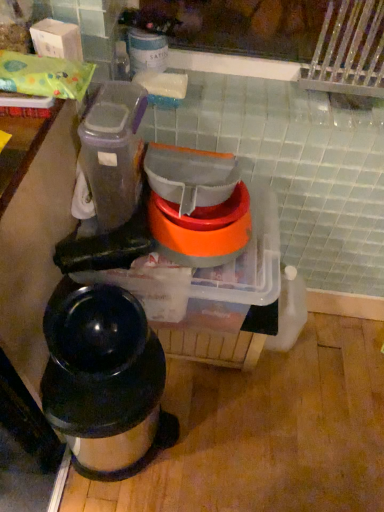
Describe the element at coordinates (191, 255) in the screenshot. Image resolution: width=384 pixels, height=512 pixels. I see `translucent plastic containers at center, the 1th appliance positioned from the bottom` at that location.

Image resolution: width=384 pixels, height=512 pixels. I want to click on translucent plastic container at upper left, acting as the 1th appliance starting from the top, so click(x=113, y=151).

This screenshot has height=512, width=384. What do you see at coordinates (201, 230) in the screenshot?
I see `orange translucent bowls at center, which is counted as the 2th appliance, starting from the top` at bounding box center [201, 230].

This screenshot has height=512, width=384. I want to click on translucent plastic containers at center, which appears as the 3th appliance when viewed from the top, so click(x=191, y=255).

Which of these two, orange translucent bowls at center, which is counted as the 2th appliance, starting from the top, or translucent plastic containers at center, which appears as the 3th appliance when viewed from the top, is wider?

translucent plastic containers at center, which appears as the 3th appliance when viewed from the top.

Considering the sizes of objects orange translucent bowls at center, which is counted as the 2th appliance, starting from the top, and translucent plastic containers at center, the 1th appliance positioned from the bottom, in the image provided, who is bigger, orange translucent bowls at center, which is counted as the 2th appliance, starting from the top, or translucent plastic containers at center, the 1th appliance positioned from the bottom,?

translucent plastic containers at center, the 1th appliance positioned from the bottom.

Considering the positions of objects translucent plastic containers at center, which appears as the 3th appliance when viewed from the top, and translucent plastic container at upper left, acting as the 1th appliance starting from the top, in the image provided, who is more to the left, translucent plastic containers at center, which appears as the 3th appliance when viewed from the top, or translucent plastic container at upper left, acting as the 1th appliance starting from the top,?

translucent plastic container at upper left, acting as the 1th appliance starting from the top, is more to the left.

Consider the image. From the image's perspective, is translucent plastic containers at center, the 1th appliance positioned from the bottom, below translucent plastic container at upper left, acting as the 1th appliance starting from the top?

Correct, translucent plastic containers at center, the 1th appliance positioned from the bottom, appears lower than translucent plastic container at upper left, acting as the 1th appliance starting from the top, in the image.

Is translucent plastic containers at center, which appears as the 3th appliance when viewed from the top, looking in the opposite direction of translucent plastic container at upper left, which is the 3th appliance in bottom-to-top order?

No, translucent plastic containers at center, which appears as the 3th appliance when viewed from the top, is not facing away from translucent plastic container at upper left, which is the 3th appliance in bottom-to-top order.

From a real-world perspective, which object stands above the other?

translucent plastic container at upper left, which is the 3th appliance in bottom-to-top order.

Between translucent plastic containers at center, which appears as the 3th appliance when viewed from the top, and orange translucent bowls at center, which appears as the 2th appliance when ordered from the bottom, which one has less height?

Standing shorter between the two is orange translucent bowls at center, which appears as the 2th appliance when ordered from the bottom.

Which object is positioned more to the left, translucent plastic containers at center, the 1th appliance positioned from the bottom, or orange translucent bowls at center, which is counted as the 2th appliance, starting from the top?

Positioned to the left is translucent plastic containers at center, the 1th appliance positioned from the bottom.

Consider the image. From a real-world perspective, is translucent plastic containers at center, the 1th appliance positioned from the bottom, physically located above or below orange translucent bowls at center, which is counted as the 2th appliance, starting from the top?

From a real-world perspective, translucent plastic containers at center, the 1th appliance positioned from the bottom, is physically below orange translucent bowls at center, which is counted as the 2th appliance, starting from the top.

From the image's perspective, is translucent plastic containers at center, which appears as the 3th appliance when viewed from the top, positioned above or below orange translucent bowls at center, which appears as the 2th appliance when ordered from the bottom?

translucent plastic containers at center, which appears as the 3th appliance when viewed from the top, is below orange translucent bowls at center, which appears as the 2th appliance when ordered from the bottom.

Would you consider translucent plastic container at upper left, which is the 3th appliance in bottom-to-top order, to be distant from translucent plastic containers at center, which appears as the 3th appliance when viewed from the top?

That's not correct — translucent plastic container at upper left, which is the 3th appliance in bottom-to-top order, is a little close to translucent plastic containers at center, which appears as the 3th appliance when viewed from the top.

Based on the photo, is translucent plastic container at upper left, which is the 3th appliance in bottom-to-top order, bigger or smaller than translucent plastic containers at center, which appears as the 3th appliance when viewed from the top?

Clearly, translucent plastic container at upper left, which is the 3th appliance in bottom-to-top order, is smaller in size than translucent plastic containers at center, which appears as the 3th appliance when viewed from the top.

Is translucent plastic container at upper left, acting as the 1th appliance starting from the top, positioned with its back to translucent plastic containers at center, which appears as the 3th appliance when viewed from the top?

That's not correct — translucent plastic container at upper left, acting as the 1th appliance starting from the top, is not looking away from translucent plastic containers at center, which appears as the 3th appliance when viewed from the top.

How different are the orientations of translucent plastic container at upper left, which is the 3th appliance in bottom-to-top order, and orange translucent bowls at center, which appears as the 2th appliance when ordered from the bottom, in degrees?

The angle between the facing direction of translucent plastic container at upper left, which is the 3th appliance in bottom-to-top order, and the facing direction of orange translucent bowls at center, which appears as the 2th appliance when ordered from the bottom, is 0.00031 degrees.

How distant is translucent plastic container at upper left, acting as the 1th appliance starting from the top, from orange translucent bowls at center, which appears as the 2th appliance when ordered from the bottom?

The distance of translucent plastic container at upper left, acting as the 1th appliance starting from the top, from orange translucent bowls at center, which appears as the 2th appliance when ordered from the bottom, is 6.36 inches.

Considering the sizes of objects translucent plastic container at upper left, acting as the 1th appliance starting from the top, and orange translucent bowls at center, which is counted as the 2th appliance, starting from the top, in the image provided, who is bigger, translucent plastic container at upper left, acting as the 1th appliance starting from the top, or orange translucent bowls at center, which is counted as the 2th appliance, starting from the top,?

Bigger between the two is translucent plastic container at upper left, acting as the 1th appliance starting from the top.

Which is more to the right, translucent plastic container at upper left, acting as the 1th appliance starting from the top, or orange translucent bowls at center, which appears as the 2th appliance when ordered from the bottom?

orange translucent bowls at center, which appears as the 2th appliance when ordered from the bottom.

Is orange translucent bowls at center, which is counted as the 2th appliance, starting from the top, bigger than translucent plastic container at upper left, acting as the 1th appliance starting from the top?

Actually, orange translucent bowls at center, which is counted as the 2th appliance, starting from the top, might be smaller than translucent plastic container at upper left, acting as the 1th appliance starting from the top.

From a real-world perspective, who is located lower, orange translucent bowls at center, which appears as the 2th appliance when ordered from the bottom, or translucent plastic container at upper left, acting as the 1th appliance starting from the top?

From a 3D spatial view, orange translucent bowls at center, which appears as the 2th appliance when ordered from the bottom, is below.

Would you consider orange translucent bowls at center, which appears as the 2th appliance when ordered from the bottom, to be distant from translucent plastic container at upper left, acting as the 1th appliance starting from the top?

They are positioned close to each other.

In the scene shown: How distant is orange translucent bowls at center, which appears as the 2th appliance when ordered from the bottom, from translucent plastic container at upper left, which is the 3th appliance in bottom-to-top order?

orange translucent bowls at center, which appears as the 2th appliance when ordered from the bottom, and translucent plastic container at upper left, which is the 3th appliance in bottom-to-top order, are 16.16 centimeters apart.

Based on the photo, which of these two, translucent plastic container at upper left, acting as the 1th appliance starting from the top, or shiny black thermos at lower left, stands taller?

shiny black thermos at lower left.

Considering the sizes of objects translucent plastic container at upper left, acting as the 1th appliance starting from the top, and shiny black thermos at lower left in the image provided, who is bigger, translucent plastic container at upper left, acting as the 1th appliance starting from the top, or shiny black thermos at lower left?

shiny black thermos at lower left.

Does translucent plastic container at upper left, which is the 3th appliance in bottom-to-top order, turn towards shiny black thermos at lower left?

No, translucent plastic container at upper left, which is the 3th appliance in bottom-to-top order, is not turned towards shiny black thermos at lower left.

You are a GUI agent. You are given a task and a screenshot of the screen. Output one action in this format:
    pyautogui.click(x=<x>, y=<y>)
    Task: Click on the waste container behind the translucent plastic container at upper left, which is the 3th appliance in bottom-to-top order
    The image size is (384, 512).
    Given the screenshot: What is the action you would take?
    pyautogui.click(x=105, y=381)

You are a GUI agent. You are given a task and a screenshot of the screen. Output one action in this format:
    pyautogui.click(x=<x>, y=<y>)
    Task: Click on the 1st appliance above when counting from the translucent plastic containers at center, which appears as the 3th appliance when viewed from the top (from the image's perspective)
    
    Given the screenshot: What is the action you would take?
    pyautogui.click(x=201, y=230)

Locate an element on the screen. The height and width of the screenshot is (512, 384). appliance that is the 2nd one when counting forward from the translucent plastic containers at center, which appears as the 3th appliance when viewed from the top is located at coordinates (113, 151).

From the image, which object appears to be farther from shiny black thermos at lower left, orange translucent bowls at center, which appears as the 2th appliance when ordered from the bottom, or translucent plastic containers at center, the 1th appliance positioned from the bottom?

orange translucent bowls at center, which appears as the 2th appliance when ordered from the bottom, is further to shiny black thermos at lower left.

When comparing their distances from orange translucent bowls at center, which appears as the 2th appliance when ordered from the bottom, does translucent plastic container at upper left, acting as the 1th appliance starting from the top, or shiny black thermos at lower left seem further?

The object further to orange translucent bowls at center, which appears as the 2th appliance when ordered from the bottom, is shiny black thermos at lower left.

Considering their positions, is orange translucent bowls at center, which is counted as the 2th appliance, starting from the top, positioned further to translucent plastic container at upper left, acting as the 1th appliance starting from the top, than shiny black thermos at lower left?

shiny black thermos at lower left lies further to translucent plastic container at upper left, acting as the 1th appliance starting from the top, than the other object.

From the image, which object appears to be farther from translucent plastic containers at center, which appears as the 3th appliance when viewed from the top, orange translucent bowls at center, which appears as the 2th appliance when ordered from the bottom, or translucent plastic container at upper left, acting as the 1th appliance starting from the top?

The object further to translucent plastic containers at center, which appears as the 3th appliance when viewed from the top, is translucent plastic container at upper left, acting as the 1th appliance starting from the top.

Which object lies nearer to the anchor point orange translucent bowls at center, which appears as the 2th appliance when ordered from the bottom, translucent plastic containers at center, the 1th appliance positioned from the bottom, or translucent plastic container at upper left, acting as the 1th appliance starting from the top?

translucent plastic containers at center, the 1th appliance positioned from the bottom, is closer to orange translucent bowls at center, which appears as the 2th appliance when ordered from the bottom.

When comparing their distances from shiny black thermos at lower left, does translucent plastic containers at center, which appears as the 3th appliance when viewed from the top, or orange translucent bowls at center, which appears as the 2th appliance when ordered from the bottom, seem closer?

translucent plastic containers at center, which appears as the 3th appliance when viewed from the top.

From the image, which object appears to be nearer to orange translucent bowls at center, which appears as the 2th appliance when ordered from the bottom, translucent plastic container at upper left, acting as the 1th appliance starting from the top, or translucent plastic containers at center, which appears as the 3th appliance when viewed from the top?

translucent plastic containers at center, which appears as the 3th appliance when viewed from the top, is closer to orange translucent bowls at center, which appears as the 2th appliance when ordered from the bottom.

Considering their positions, is translucent plastic container at upper left, which is the 3th appliance in bottom-to-top order, positioned further to translucent plastic containers at center, which appears as the 3th appliance when viewed from the top, than shiny black thermos at lower left?

Based on the image, shiny black thermos at lower left appears to be further to translucent plastic containers at center, which appears as the 3th appliance when viewed from the top.

This screenshot has height=512, width=384. In order to click on appliance between orange translucent bowls at center, which appears as the 2th appliance when ordered from the bottom, and shiny black thermos at lower left, in the vertical direction in this screenshot , I will do `click(191, 255)`.

The height and width of the screenshot is (512, 384). Identify the location of appliance that lies between translucent plastic container at upper left, which is the 3th appliance in bottom-to-top order, and translucent plastic containers at center, which appears as the 3th appliance when viewed from the top, from top to bottom. (201, 230).